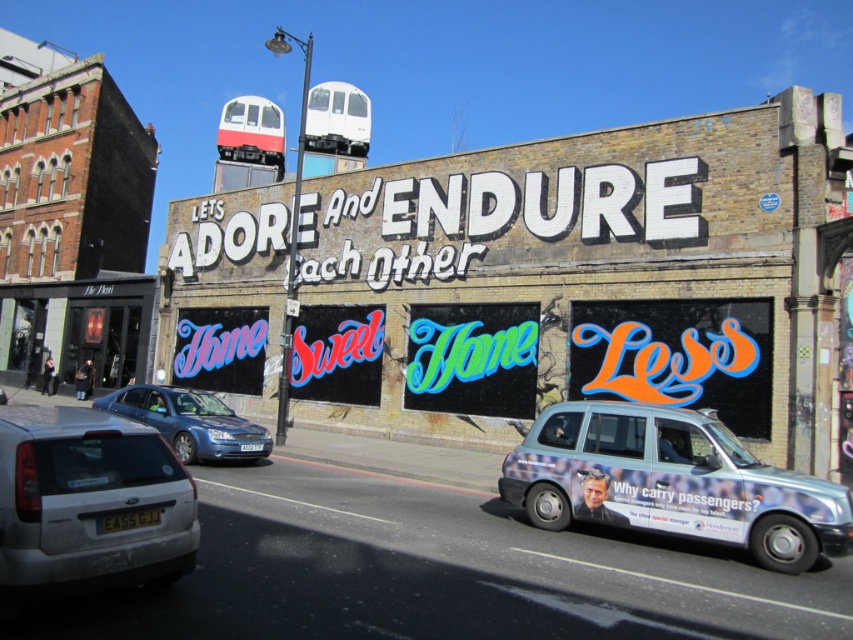
Question: Does silver metallic taxi at lower right appear on the right side of silver metallic hatchback at lower left?

Choices:
 (A) no
 (B) yes

Answer: (B)

Question: Based on their relative distances, which object is farther from the silver metallic hatchback at lower left?

Choices:
 (A) silver metallic taxi at lower right
 (B) blue metallic sedan at center

Answer: (B)

Question: Can you confirm if silver metallic hatchback at lower left is wider than blue metallic sedan at center?

Choices:
 (A) no
 (B) yes

Answer: (A)

Question: Which point is farther from the camera taking this photo?

Choices:
 (A) (260, 444)
 (B) (163, 556)

Answer: (A)

Question: Among these points, which one is nearest to the camera?

Choices:
 (A) (627, 490)
 (B) (80, 509)

Answer: (B)

Question: Is silver metallic hatchback at lower left closer to the viewer compared to blue metallic sedan at center?

Choices:
 (A) no
 (B) yes

Answer: (B)